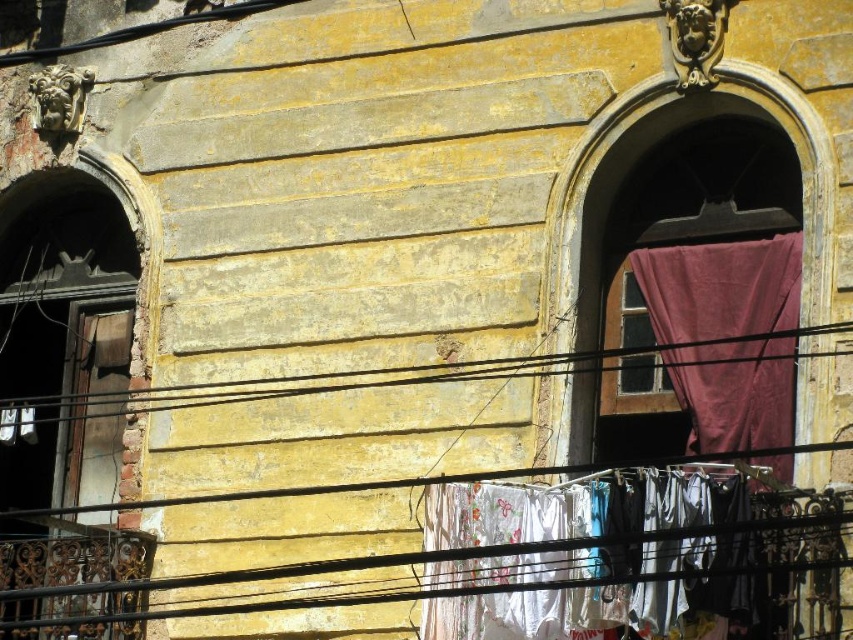
Can you confirm if white fabric laundry at center is taller than purple fabric curtain at right?

In fact, white fabric laundry at center may be shorter than purple fabric curtain at right.

Does white fabric laundry at center appear under purple fabric curtain at right?

Yes.

You are a GUI agent. You are given a task and a screenshot of the screen. Output one action in this format:
    pyautogui.click(x=<x>, y=<y>)
    Task: Click on the white fabric laundry at center
    This screenshot has height=640, width=853.
    Given the screenshot: What is the action you would take?
    pyautogui.click(x=573, y=506)